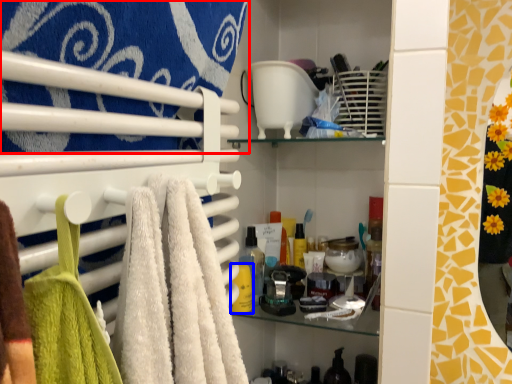
Question: Which object is further to the camera taking this photo, towel (highlighted by a red box) or toiletry (highlighted by a blue box)?

Choices:
 (A) towel
 (B) toiletry

Answer: (B)